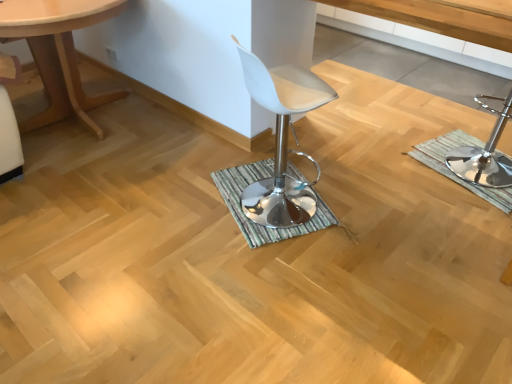
What are the coordinates of `free space in front of green striped bath mat at center, which is counted as the 1th bath mat, starting from the left` in the screenshot? It's located at (283, 283).